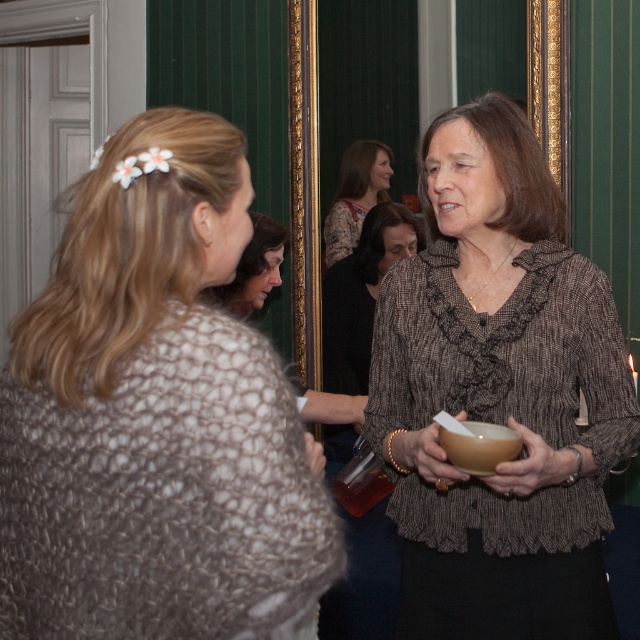
In the scene shown: You are a photographer at the event and want to ensure both the brown textured blouse at center and the matte black hair at center are clearly visible in your photo. Given their sizes, which one might you need to adjust your camera angle for to avoid cropping?

The brown textured blouse at center is much taller than the matte black hair at center, so you might need to adjust your camera angle to accommodate its height to ensure it isn

You are a photographer at the event and want to capture a photo of both the brown textured blouse at center and the matte black hair at center. Which object should you focus on first if you want to include both in the frame without moving the camera?

The brown textured blouse at center is positioned on the right side of matte black hair at center, so you should focus on the matte black hair at center first to ensure both are in the frame.